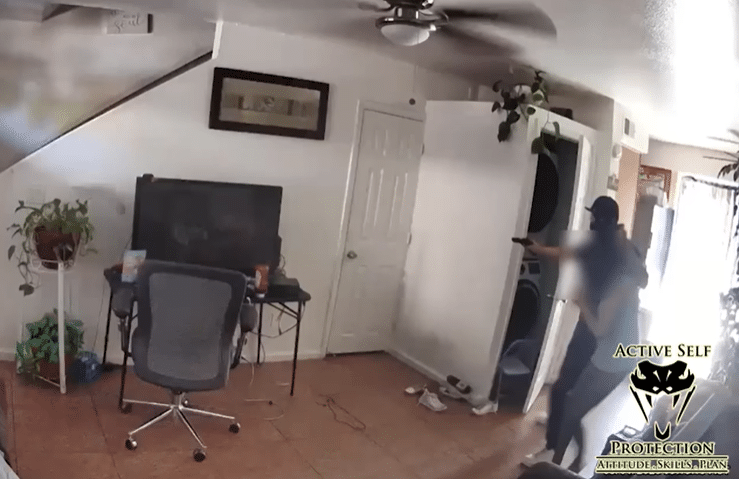
Locate an element on the screen. This screenshot has height=479, width=739. door knob is located at coordinates (353, 255), (568, 302).